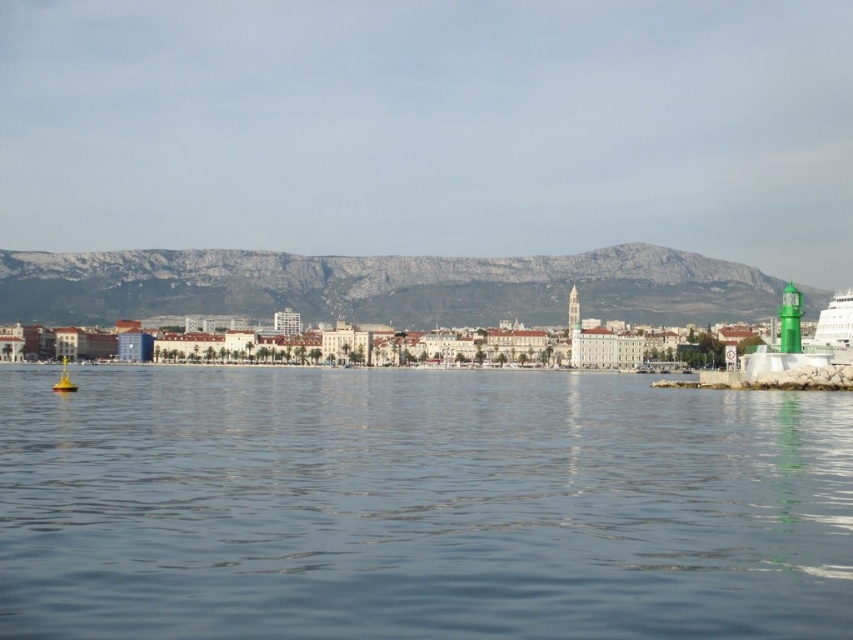
Question: Which object is farther from the camera taking this photo?

Choices:
 (A) yellow matte buoy at lower left
 (B) blue water at center
 (C) gray rocky mountain at upper center

Answer: (C)

Question: Considering the real-world distances, which object is closest to the yellow matte buoy at lower left?

Choices:
 (A) gray rocky mountain at upper center
 (B) blue water at center

Answer: (B)

Question: Does gray rocky mountain at upper center have a smaller size compared to yellow matte buoy at lower left?

Choices:
 (A) no
 (B) yes

Answer: (A)

Question: Is gray rocky mountain at upper center wider than yellow matte buoy at lower left?

Choices:
 (A) yes
 (B) no

Answer: (A)

Question: Which point is farther from the camera taking this photo?

Choices:
 (A) (242, 252)
 (B) (67, 381)

Answer: (A)

Question: Can you confirm if blue water at center is positioned above yellow matte buoy at lower left?

Choices:
 (A) yes
 (B) no

Answer: (B)